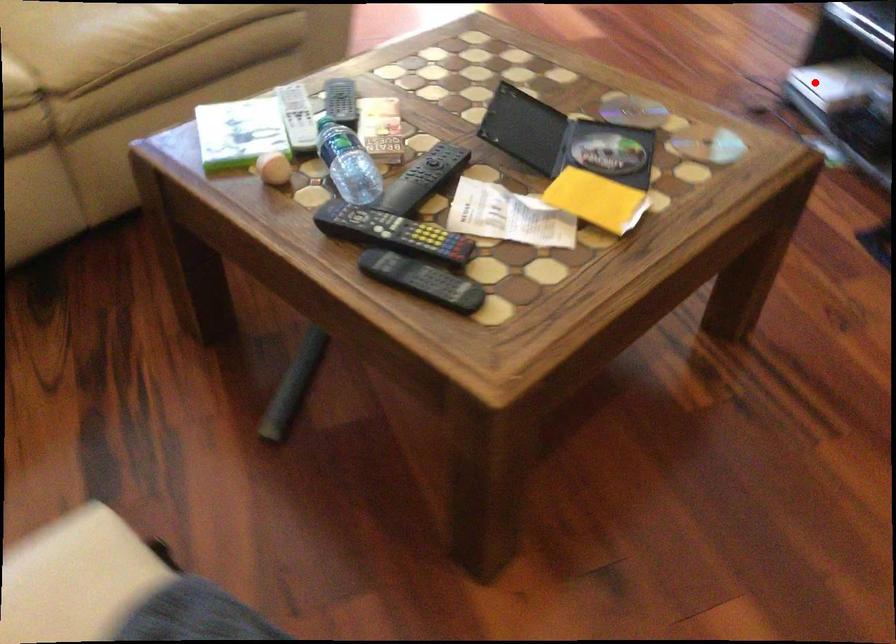
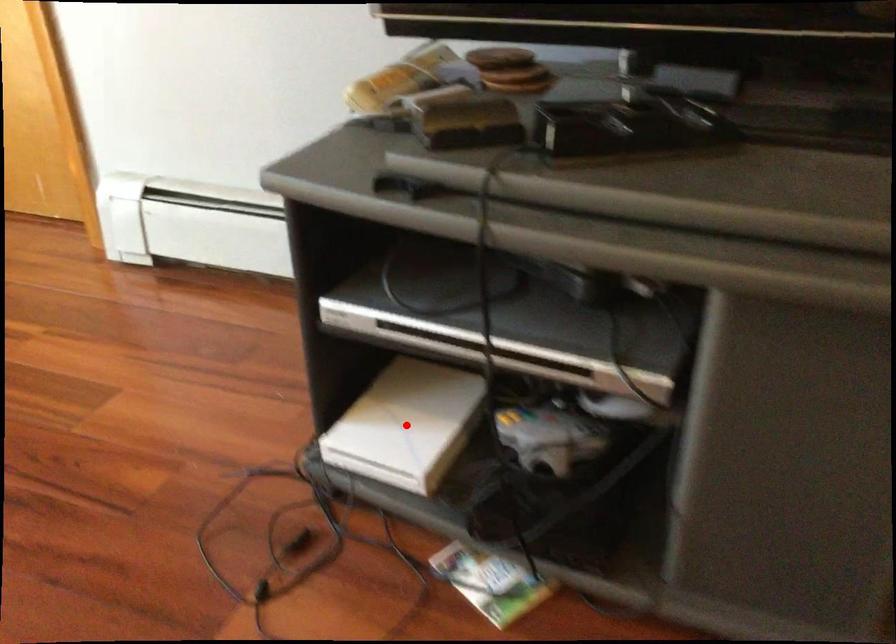
I am providing you with two images of the same scene from different viewpoints. A red point is marked on the first image and another point is marked on the second image. Are the points marked in image1 and image2 representing the same 3D position?

Yes